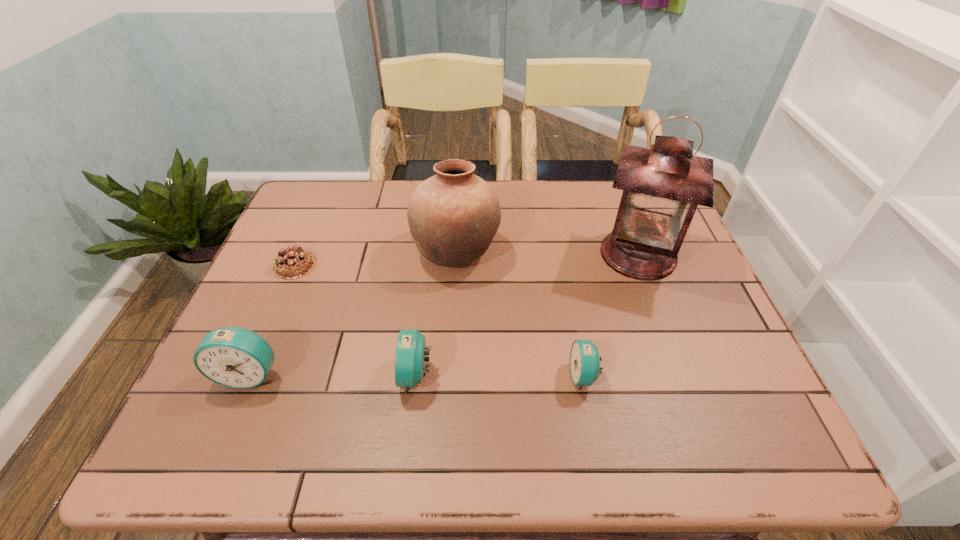
This screenshot has width=960, height=540. Identify the location of free space located on the front-facing side of the second alarm clock from left to right. (263, 375).

Where is `vacant area situated 0.100m on the front-facing side of the second alarm clock from left to right`? The image size is (960, 540). vacant area situated 0.100m on the front-facing side of the second alarm clock from left to right is located at coordinates (352, 375).

You are a GUI agent. You are given a task and a screenshot of the screen. Output one action in this format:
    pyautogui.click(x=<x>, y=<y>)
    Task: Click on the free space located on the front-facing side of the second alarm clock from left to right
    This screenshot has width=960, height=540.
    Given the screenshot: What is the action you would take?
    367,375

Find the location of a particular element. This screenshot has height=540, width=960. free space located on the front-facing side of the second shortest object is located at coordinates (546, 376).

Where is `vacant region located on the front-facing side of the second shortest object`? Image resolution: width=960 pixels, height=540 pixels. vacant region located on the front-facing side of the second shortest object is located at coordinates (527, 376).

Find the location of a particular element. The image size is (960, 540). free location located 0.120m on the front-facing side of the second shortest object is located at coordinates (513, 376).

In order to click on blank area located 0.320m on the front of the pottery in this screenshot , I will do `click(448, 396)`.

Where is `free region located 0.080m on the right of the shortest object`? The width and height of the screenshot is (960, 540). free region located 0.080m on the right of the shortest object is located at coordinates (347, 265).

The image size is (960, 540). Identify the location of blank space located on the back of the oil lamp. (611, 182).

Where is `pottery that is at the far edge`? pottery that is at the far edge is located at coordinates (453, 216).